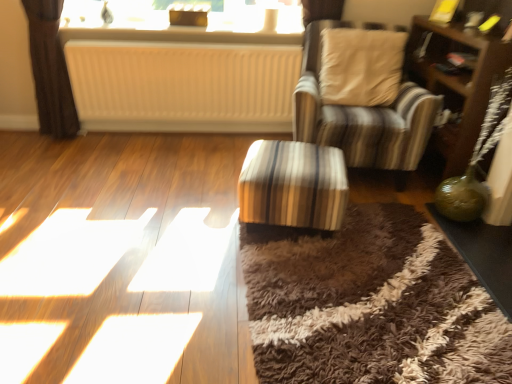
Locate an element on the screen. The width and height of the screenshot is (512, 384). free point in front of striped fabric ottoman at center, which ranks as the first table in left-to-right order is located at coordinates (314, 275).